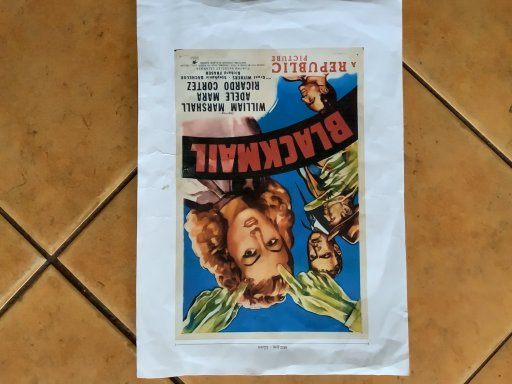
The image size is (512, 384). I want to click on matte paper poster at center, so click(x=270, y=188).

The height and width of the screenshot is (384, 512). What do you see at coordinates (270, 188) in the screenshot? I see `matte paper poster at center` at bounding box center [270, 188].

Locate an element on the screen. Image resolution: width=512 pixels, height=384 pixels. matte paper poster at center is located at coordinates (270, 188).